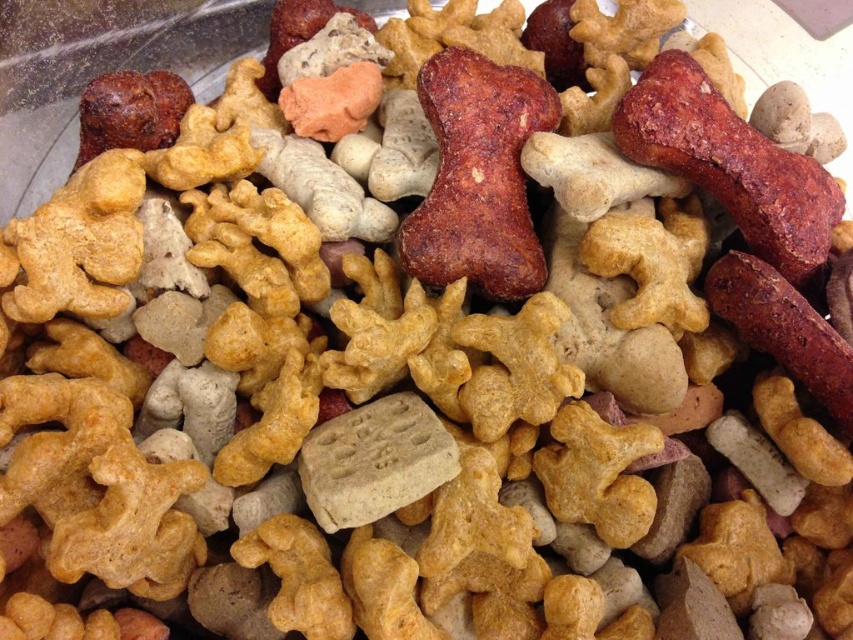
Between brown crumbly bone at center and red matte bone at center, which one appears on the right side from the viewer's perspective?

From the viewer's perspective, red matte bone at center appears more on the right side.

Does brown crumbly bone at center have a lesser height compared to red matte bone at center?

No.

Who is more distant from viewer, (442, 218) or (666, 83)?

Positioned behind is point (666, 83).

The height and width of the screenshot is (640, 853). In order to click on brown crumbly bone at center in this screenshot , I will do `click(479, 177)`.

Can you confirm if red matte bone at center is positioned to the left of dark brown textured sausage at right?

Yes, red matte bone at center is to the left of dark brown textured sausage at right.

Is red matte bone at center shorter than dark brown textured sausage at right?

Incorrect, red matte bone at center's height does not fall short of dark brown textured sausage at right's.

Who is more forward, (657, 124) or (756, 342)?

Positioned in front is point (657, 124).

In order to click on red matte bone at center in this screenshot , I will do `click(730, 164)`.

Between point (462, 275) and point (767, 289), which one is positioned in front?

Point (767, 289)

Looking at this image, between brown crumbly bone at center and dark brown textured sausage at right, which one has less height?

dark brown textured sausage at right is shorter.

Who is more distant from viewer, (546, 120) or (822, 387)?

The point (546, 120) is more distant.

At what (x,y) coordinates should I click in order to perform the action: click on brown crumbly bone at center. Please return your answer as a coordinate pair (x, y). This screenshot has width=853, height=640. Looking at the image, I should click on (479, 177).